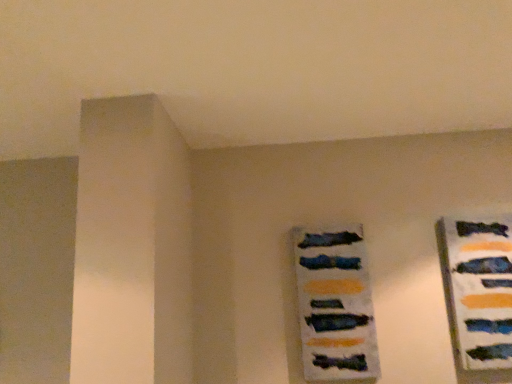
The height and width of the screenshot is (384, 512). What do you see at coordinates (335, 304) in the screenshot? I see `matte blue picture frame at center-right` at bounding box center [335, 304].

Measure the distance between point (317,290) and camera.

Point (317,290) and camera are 5.73 feet apart.

The image size is (512, 384). What are the coordinates of `matte blue picture frame at center-right` in the screenshot? It's located at (335, 304).

Describe the element at coordinates (478, 289) in the screenshot. I see `matte blue tie at right` at that location.

This screenshot has width=512, height=384. In order to click on matte blue tie at right in this screenshot , I will do `click(478, 289)`.

What is the approximate height of matte blue tie at right?

The height of matte blue tie at right is 25.53 inches.

Where is `matte blue picture frame at center-right`? The image size is (512, 384). matte blue picture frame at center-right is located at coordinates (335, 304).

Considering the positions of objects matte blue tie at right and matte blue picture frame at center-right in the image provided, who is more to the right, matte blue tie at right or matte blue picture frame at center-right?

matte blue tie at right is more to the right.

Who is more distant, matte blue tie at right or matte blue picture frame at center-right?

matte blue picture frame at center-right is further from the camera.

Does point (486, 283) appear closer or farther from the camera than point (355, 371)?

Clearly, point (486, 283) is more distant from the camera than point (355, 371).

From the image's perspective, would you say matte blue tie at right is positioned over matte blue picture frame at center-right?

Correct, matte blue tie at right appears higher than matte blue picture frame at center-right in the image.

From a real-world perspective, who is located higher, matte blue tie at right or matte blue picture frame at center-right?

In real-world perspective, matte blue tie at right is above.

Considering the sizes of objects matte blue tie at right and matte blue picture frame at center-right in the image provided, who is thinner, matte blue tie at right or matte blue picture frame at center-right?

Thinner between the two is matte blue tie at right.

In terms of height, does matte blue tie at right look taller or shorter compared to matte blue picture frame at center-right?

matte blue tie at right is taller than matte blue picture frame at center-right.

Considering the sizes of objects matte blue tie at right and matte blue picture frame at center-right in the image provided, who is smaller, matte blue tie at right or matte blue picture frame at center-right?

With smaller size is matte blue tie at right.

Is matte blue tie at right inside or outside of matte blue picture frame at center-right?

matte blue tie at right is not inside matte blue picture frame at center-right, it's outside.

Is matte blue tie at right touching matte blue picture frame at center-right?

No, matte blue tie at right is not touching matte blue picture frame at center-right.

Consider the image. Is matte blue tie at right facing towards matte blue picture frame at center-right?

No, matte blue tie at right is not aimed at matte blue picture frame at center-right.

Can you tell me how much matte blue tie at right and matte blue picture frame at center-right differ in facing direction?

They differ by 0.479 degrees in their facing directions.

How distant is matte blue tie at right from matte blue picture frame at center-right?

They are 17.58 inches apart.

Locate an element on the screen. The image size is (512, 384). picture frame that appears behind the matte blue tie at right is located at coordinates (335, 304).

Considering the positions of objects matte blue picture frame at center-right and matte blue tie at right in the image provided, who is more to the right, matte blue picture frame at center-right or matte blue tie at right?

matte blue tie at right is more to the right.

Looking at this image, relative to matte blue tie at right, is matte blue picture frame at center-right in front or behind?

matte blue picture frame at center-right is behind matte blue tie at right.

Which is more distant, (306, 286) or (489, 306)?

The point (306, 286) is farther from the camera.

From the image's perspective, who appears lower, matte blue picture frame at center-right or matte blue tie at right?

matte blue picture frame at center-right.

From a real-world perspective, is matte blue picture frame at center-right located beneath matte blue tie at right?

Yes, from a real-world perspective, matte blue picture frame at center-right is beneath matte blue tie at right.

Which of these two, matte blue picture frame at center-right or matte blue tie at right, is wider?

matte blue picture frame at center-right.

From their relative heights in the image, would you say matte blue picture frame at center-right is taller or shorter than matte blue tie at right?

In the image, matte blue picture frame at center-right appears to be shorter than matte blue tie at right.

Which of these two, matte blue picture frame at center-right or matte blue tie at right, is bigger?

Bigger between the two is matte blue picture frame at center-right.

Is matte blue picture frame at center-right located outside matte blue tie at right?

Yes, matte blue picture frame at center-right is not within matte blue tie at right.

Is matte blue picture frame at center-right not near matte blue tie at right?

No, matte blue picture frame at center-right is in close proximity to matte blue tie at right.

Is matte blue picture frame at center-right turned away from matte blue tie at right?

matte blue picture frame at center-right does not have its back to matte blue tie at right.

How distant is matte blue picture frame at center-right from matte blue tie at right?

matte blue picture frame at center-right is 17.58 inches from matte blue tie at right.

Image resolution: width=512 pixels, height=384 pixels. Identify the location of picture frame behind the matte blue tie at right. (335, 304).

Locate an element on the screen. design above the matte blue picture frame at center-right (from a real-world perspective) is located at coordinates (478, 289).

This screenshot has height=384, width=512. What are the coordinates of `picture frame directly beneath the matte blue tie at right (from a real-world perspective)` in the screenshot? It's located at (335, 304).